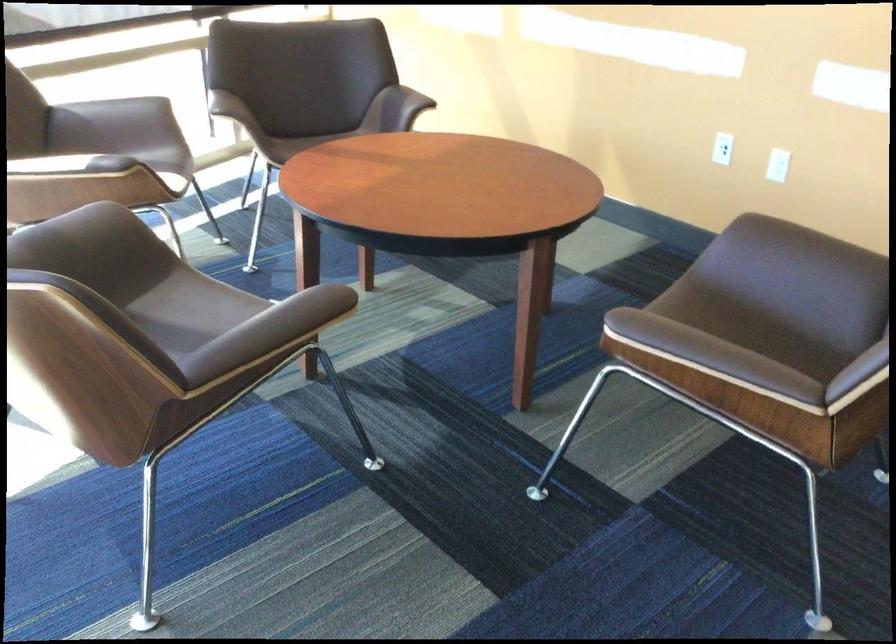
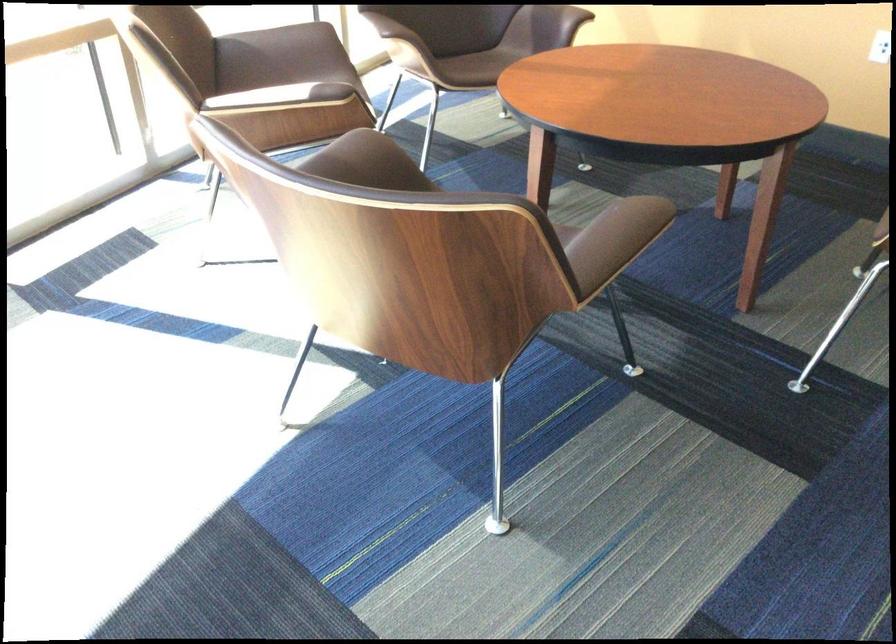
Question: I am providing you with two images of the same scene from different viewpoints. Please identify which objects are invisible in image2.

Choices:
 (A) brown chair armrest
 (B) black electric stapler
 (C) chair sitting surface
 (D) brown chair sitting surface

Answer: (C)